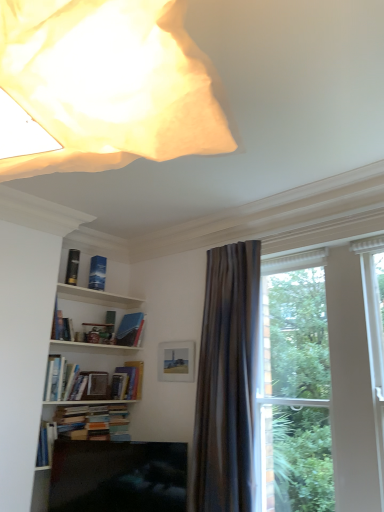
Question: Is metallic gold bookshelf at upper left, which is counted as the 1th book, starting from the top, inside the boundaries of blue matte book at upper center, which is the 3th book in top-to-bottom order, or outside?

Choices:
 (A) outside
 (B) inside

Answer: (A)

Question: Considering the positions of metallic gold bookshelf at upper left, positioned as the fifth book in bottom-to-top order, and blue matte book at upper center, which is the 3th book in top-to-bottom order, in the image, is metallic gold bookshelf at upper left, positioned as the fifth book in bottom-to-top order, bigger or smaller than blue matte book at upper center, which is the 3th book in top-to-bottom order,?

Choices:
 (A) big
 (B) small

Answer: (B)

Question: Which of these objects is positioned farthest from the blue matte book at upper center, which is the 3th book in top-to-bottom order?

Choices:
 (A) hardcover book at center, the 4th book viewed from the top
 (B) clear glass window at right
 (C) matte white picture frame at center
 (D) blue matte bookshelf at upper left, positioned as the 2th book in top-to-bottom order
 (E) matte black tv at lower center

Answer: (B)

Question: Which object is the farthest from the hardcover books at lower left, marked as the 1th book in a bottom-to-top arrangement?

Choices:
 (A) blue matte book at upper center, which is the 3th book in top-to-bottom order
 (B) white wooden shelf at upper left
 (C) hardcover book at center, which appears as the second book when ordered from the bottom
 (D) matte black tv at lower center
 (E) silky gray curtain at right

Answer: (E)